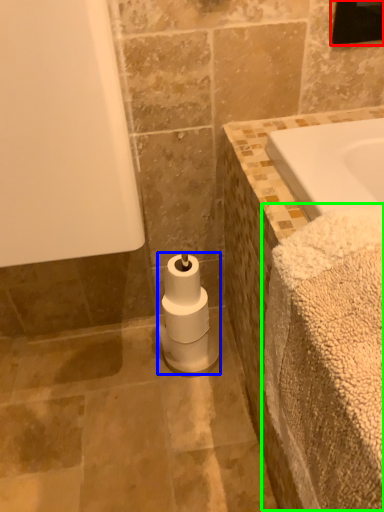
Question: Considering the real-world distances, which object is closest to mirror (highlighted by a red box)? toilet paper (highlighted by a blue box) or bath towel (highlighted by a green box).

Choices:
 (A) toilet paper
 (B) bath towel

Answer: (B)